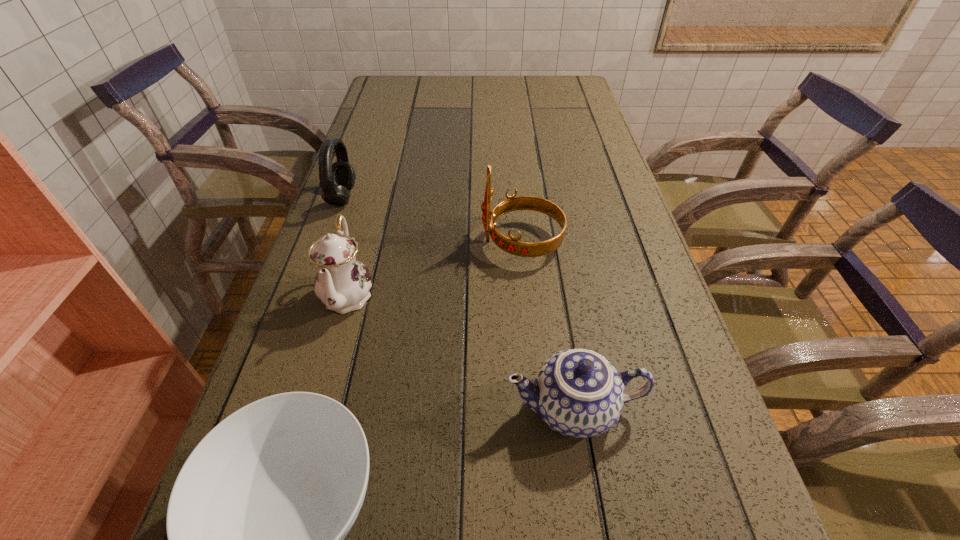
Find the location of `vacant space situated 0.090m from the spout of the rightmost chinaware`. vacant space situated 0.090m from the spout of the rightmost chinaware is located at coordinates (451, 408).

Image resolution: width=960 pixels, height=540 pixels. What are the coordinates of `blank area located from the spout of the rightmost chinaware` in the screenshot? It's located at (415, 408).

Where is `chinaware present at the left edge`? Image resolution: width=960 pixels, height=540 pixels. chinaware present at the left edge is located at coordinates (342, 283).

At what (x,y) coordinates should I click in order to perform the action: click on headset that is positioned at the left edge. Please return your answer as a coordinate pair (x, y). This screenshot has height=540, width=960. Looking at the image, I should click on pyautogui.click(x=337, y=179).

Image resolution: width=960 pixels, height=540 pixels. I want to click on object situated at the right edge, so click(x=578, y=393).

This screenshot has width=960, height=540. I want to click on vacant area at the far edge, so click(x=476, y=79).

In the image, there is a desktop. Where is `vacant space at the left edge`? This screenshot has height=540, width=960. vacant space at the left edge is located at coordinates (309, 277).

The image size is (960, 540). What are the coordinates of `free location at the right edge of the desktop` in the screenshot? It's located at (597, 283).

Locate an element on the screen. The image size is (960, 540). vacant space at the far left corner of the desktop is located at coordinates (383, 96).

The image size is (960, 540). Identify the location of free space at the far right corner. (558, 97).